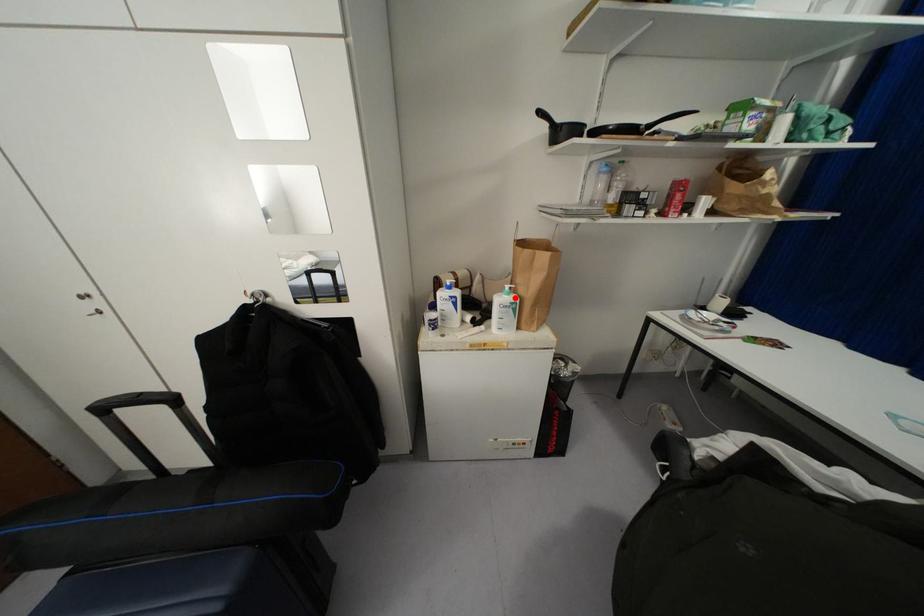
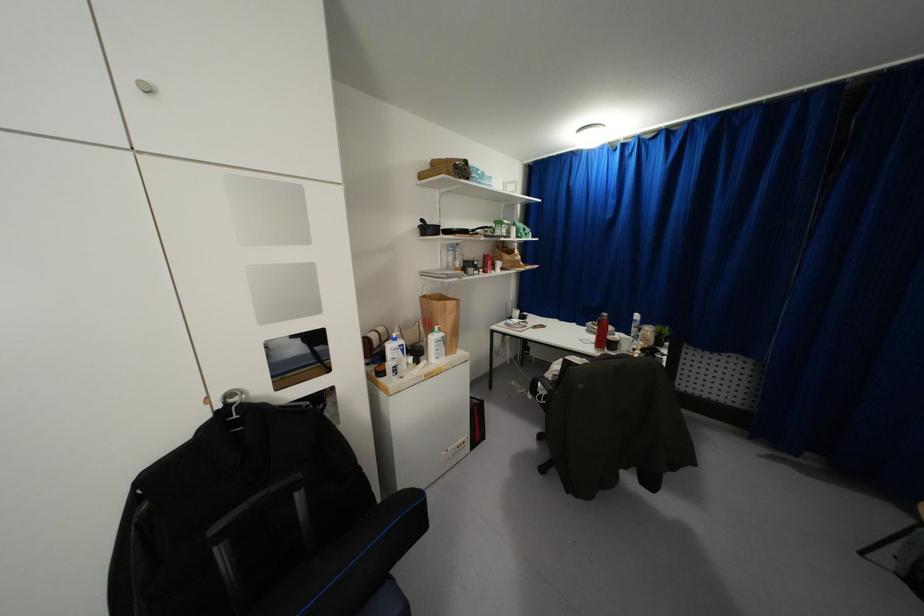
The point at the highlighted location is marked in the first image. Where is the corresponding point in the second image?

(442, 333)